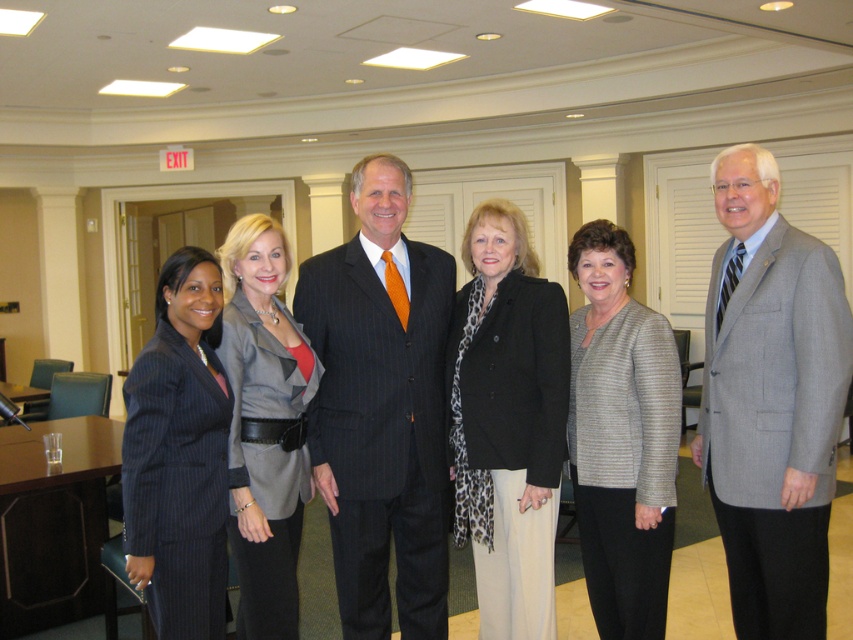
Question: Is pinstripe suit at center further to the viewer compared to gray textured blazer at center?

Choices:
 (A) no
 (B) yes

Answer: (B)

Question: Among these points, which one is farthest from the camera?

Choices:
 (A) (337, 532)
 (B) (593, 397)
 (C) (238, 556)

Answer: (B)

Question: Among these objects, which one is farthest from the camera?

Choices:
 (A) black textured blazer at center
 (B) textured gray blazer at center
 (C) pinstripe suit at center
 (D) gray pinstripe suit at center

Answer: (C)

Question: Observing the image, what is the correct spatial positioning of black textured blazer at center in reference to textured gray blazer at center?

Choices:
 (A) below
 (B) above

Answer: (B)

Question: Is the position of gray pinstripe suit at center more distant than that of black textured blazer at center?

Choices:
 (A) no
 (B) yes

Answer: (A)

Question: Which point appears farthest from the camera in this image?

Choices:
 (A) (248, 474)
 (B) (523, 225)
 (C) (646, 408)
 (D) (218, 492)

Answer: (B)